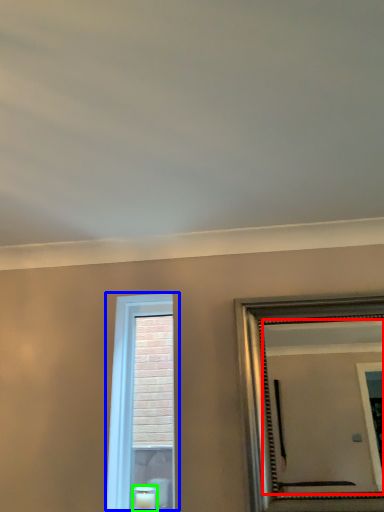
Question: Estimate the real-world distances between objects in this image. Which object is farther from mirror (highlighted by a red box), window (highlighted by a blue box) or candle (highlighted by a green box)?

Choices:
 (A) window
 (B) candle

Answer: (B)